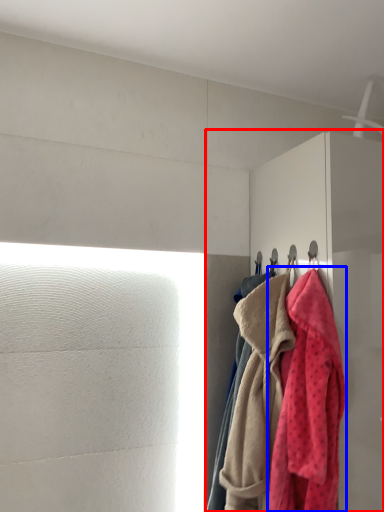
Question: Which point is further to the camera, dresser (highlighted by a red box) or towel (highlighted by a blue box)?

Choices:
 (A) dresser
 (B) towel

Answer: (A)